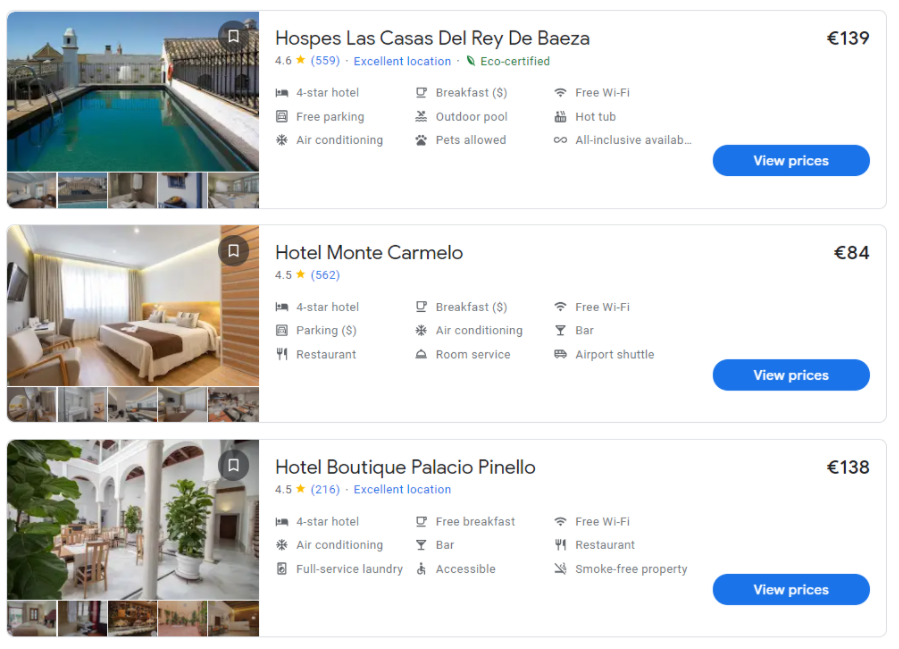
Find the location of a particular element. pillow is located at coordinates (189, 317).